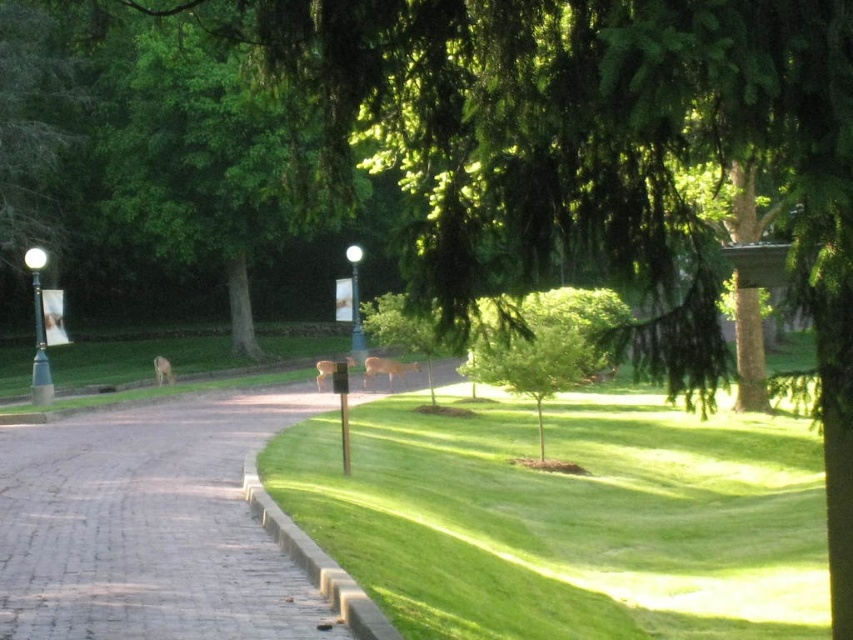
Is green leafy tree at center above white glossy lamp post at center?

Incorrect, green leafy tree at center is not positioned above white glossy lamp post at center.

Identify the location of green leafy tree at center. This screenshot has width=853, height=640. (537, 353).

The height and width of the screenshot is (640, 853). I want to click on green leafy tree at center, so click(x=537, y=353).

Is brick paved road at center to the left of green metallic pole at left from the viewer's perspective?

Incorrect, brick paved road at center is not on the left side of green metallic pole at left.

Between point (0, 620) and point (47, 401), which one is positioned behind?

Positioned behind is point (47, 401).

Who is more distant from viewer, (21, 472) or (33, 246)?

The point (33, 246) is behind.

Locate an element on the screen. This screenshot has height=640, width=853. brick paved road at center is located at coordinates (149, 525).

Is green metallic pole at left wider than white glossy lamp post at center?

Correct, the width of green metallic pole at left exceeds that of white glossy lamp post at center.

Who is shorter, green metallic pole at left or white glossy lamp post at center?

With less height is green metallic pole at left.

Image resolution: width=853 pixels, height=640 pixels. What do you see at coordinates (39, 330) in the screenshot? I see `green metallic pole at left` at bounding box center [39, 330].

I want to click on green metallic pole at left, so click(39, 330).